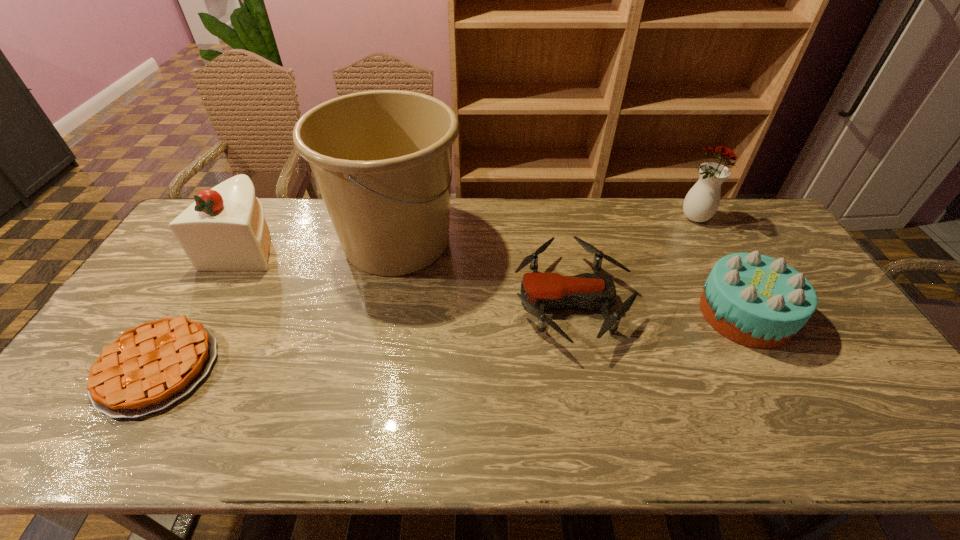
The image size is (960, 540). In order to click on vacant space that's between the bucket and the pie in this screenshot , I will do `click(277, 305)`.

I want to click on object that is the closest one to the vase, so pyautogui.click(x=757, y=301).

Select which object appears as the third closest to the vase. Please provide its 2D coordinates. Your answer should be formatted as a tuple, i.e. [(x, y)], where the tuple contains the x and y coordinates of a point satisfying the conditions above.

[(381, 159)]

The width and height of the screenshot is (960, 540). What are the coordinates of `vacant space that satisfies the following two spatial constraints: 1. on the front-facing side of the fifth tallest object; 2. on the left side of the nearer cake` in the screenshot? It's located at (574, 314).

The height and width of the screenshot is (540, 960). Identify the location of vacant space that satisfies the following two spatial constraints: 1. on the back side of the vase; 2. on the right side of the shortest object. (249, 219).

The image size is (960, 540). Find the location of `free space that satisfies the following two spatial constraints: 1. on the back side of the tallest object; 2. on the left side of the vase`. free space that satisfies the following two spatial constraints: 1. on the back side of the tallest object; 2. on the left side of the vase is located at coordinates (401, 219).

You are a GUI agent. You are given a task and a screenshot of the screen. Output one action in this format:
    pyautogui.click(x=<x>, y=<y>)
    Task: Click on the free spot that satisfies the following two spatial constraints: 1. on the back side of the right cake; 2. on the left side of the vase
    The height and width of the screenshot is (540, 960).
    Given the screenshot: What is the action you would take?
    pyautogui.click(x=692, y=219)